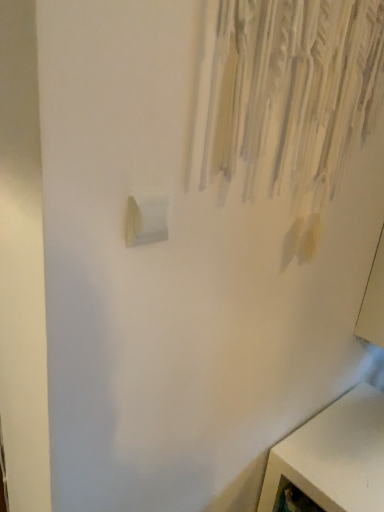
Question: Is point (365, 436) positioned closer to the camera than point (152, 200)?

Choices:
 (A) closer
 (B) farther

Answer: (B)

Question: Would you say white matte cabinet at lower right is to the left or to the right of white plastic light switch at lower left in the picture?

Choices:
 (A) right
 (B) left

Answer: (A)

Question: Is white matte cabinet at lower right in front of or behind white plastic light switch at lower left in the image?

Choices:
 (A) behind
 (B) front

Answer: (A)

Question: Considering their positions, is white plastic light switch at lower left located in front of or behind white matte cabinet at lower right?

Choices:
 (A) front
 (B) behind

Answer: (A)

Question: In terms of height, does white plastic light switch at lower left look taller or shorter compared to white matte cabinet at lower right?

Choices:
 (A) tall
 (B) short

Answer: (B)

Question: From a real-world perspective, is white plastic light switch at lower left above or below white matte cabinet at lower right?

Choices:
 (A) above
 (B) below

Answer: (A)

Question: In terms of size, does white plastic light switch at lower left appear bigger or smaller than white matte cabinet at lower right?

Choices:
 (A) small
 (B) big

Answer: (A)